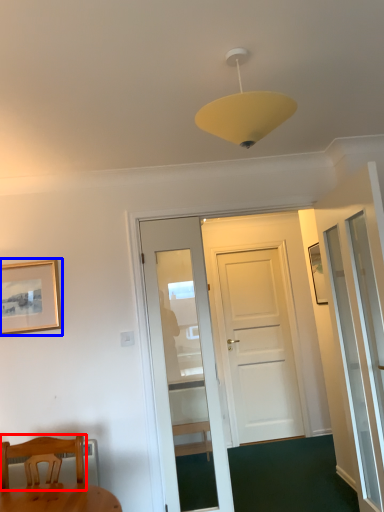
Question: Which object appears farthest to the camera in this image, chair (highlighted by a red box) or picture frame (highlighted by a blue box)?

Choices:
 (A) chair
 (B) picture frame

Answer: (B)